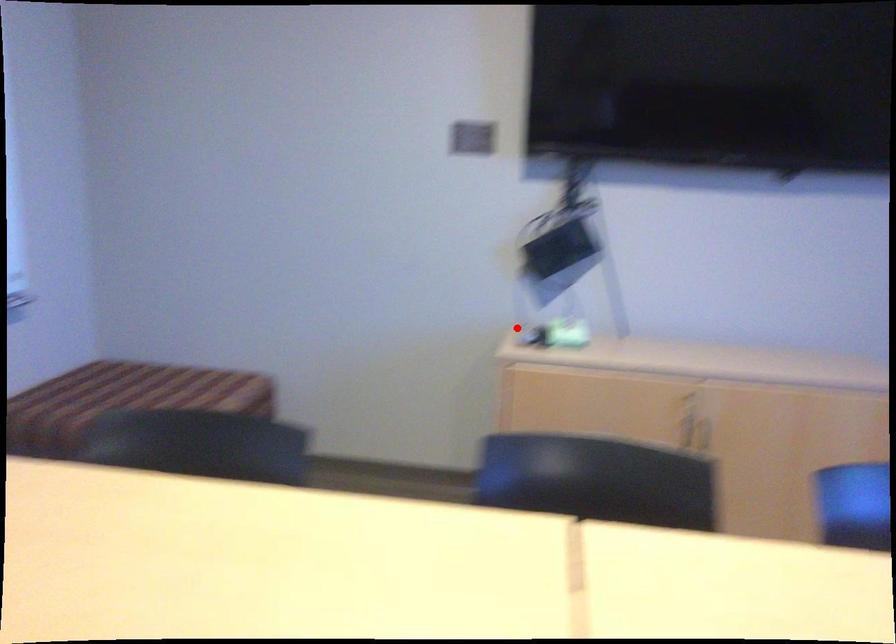
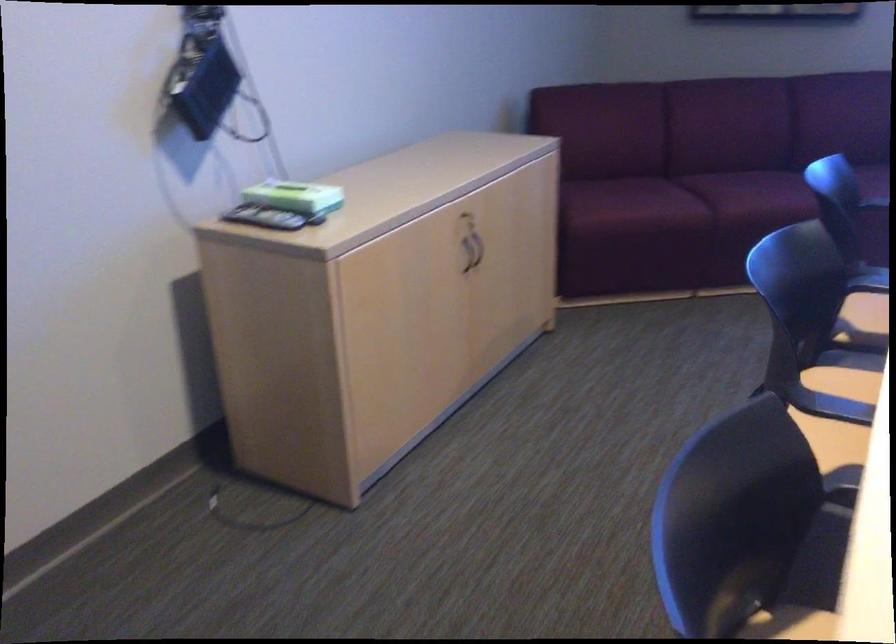
Where in the second image is the point corresponding to the highlighted location from the first image?

(263, 218)